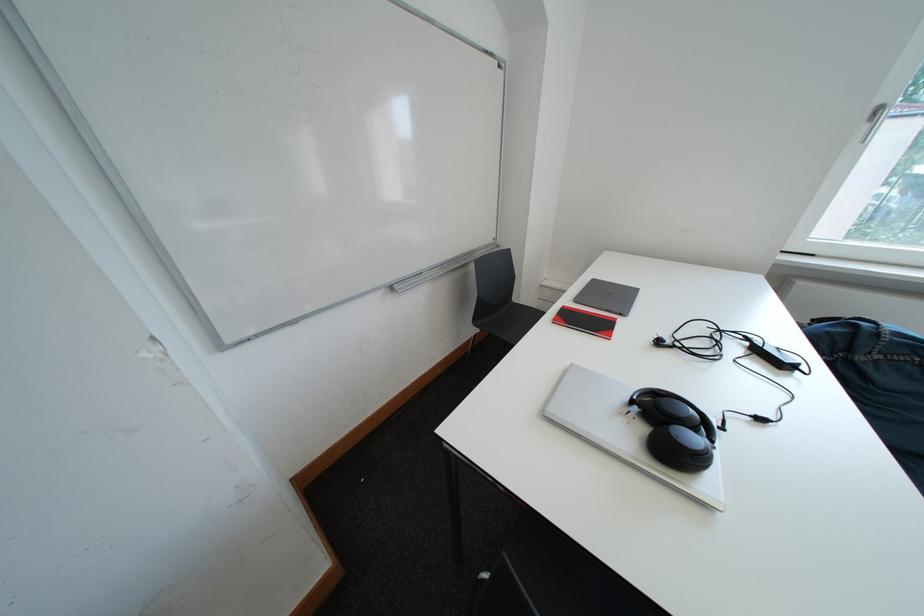
You are a GUI agent. You are given a task and a screenshot of the screen. Output one action in this format:
    pyautogui.click(x=<x>, y=<y>)
    Task: Click on the silver closed laptop
    The height and width of the screenshot is (616, 924).
    Given the screenshot: What is the action you would take?
    pyautogui.click(x=623, y=430)